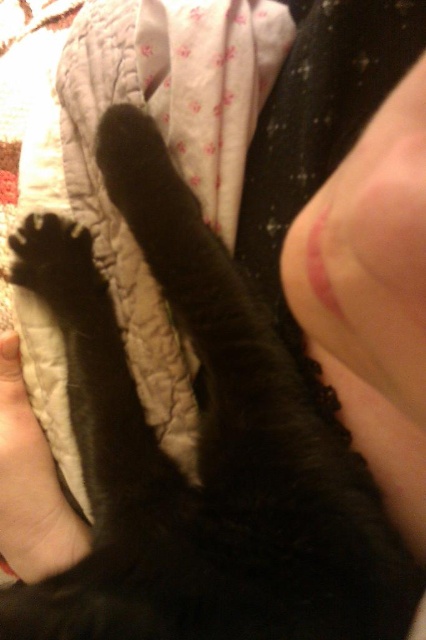
Does smooth skin at upper right have a greater width compared to smooth skin hand at lower left?

Indeed, smooth skin at upper right has a greater width compared to smooth skin hand at lower left.

Identify the location of smooth skin at upper right. Image resolution: width=426 pixels, height=640 pixels. (370, 253).